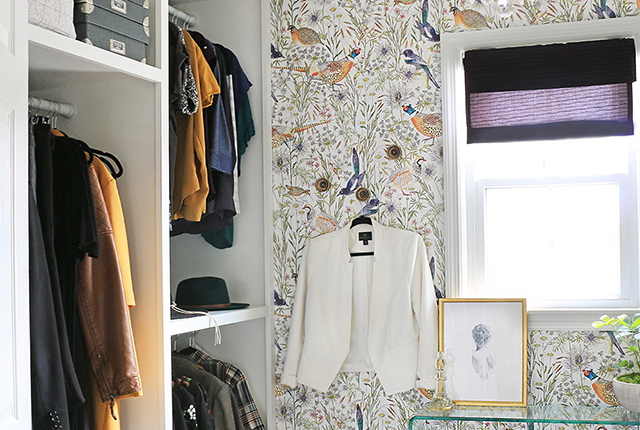
This screenshot has height=430, width=640. I want to click on window frame, so click(456, 208).